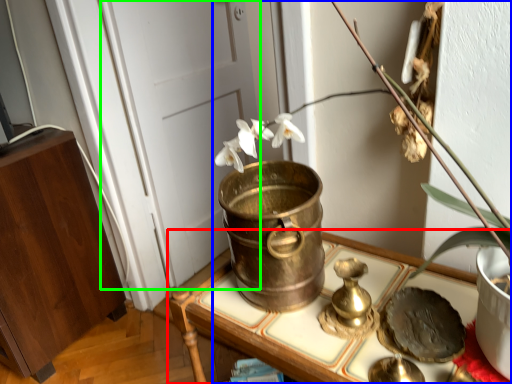
Question: Which object is the closest to the furniture (highlighted by a red box)? Choose among these: houseplant (highlighted by a blue box) or door (highlighted by a green box).

Choices:
 (A) houseplant
 (B) door

Answer: (A)